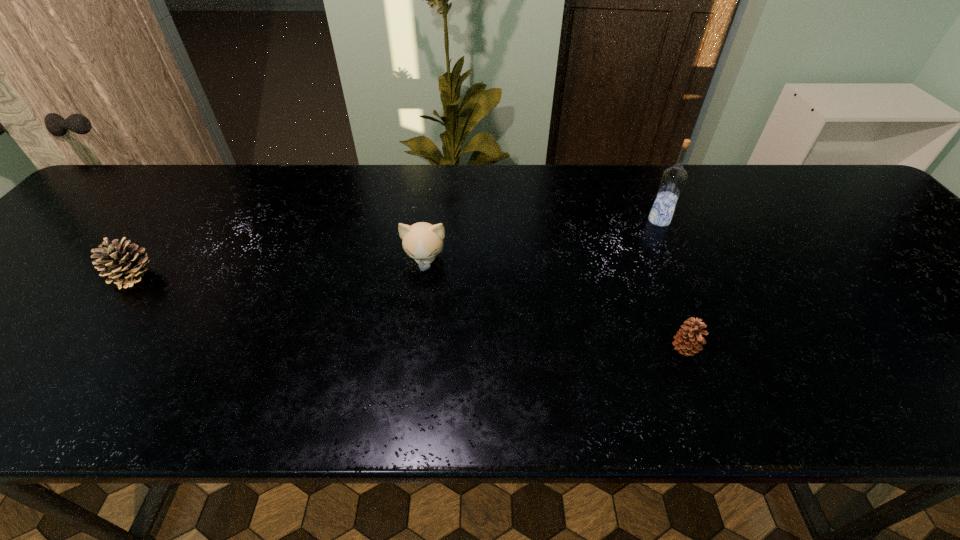
You are a GUI agent. You are given a task and a screenshot of the screen. Output one action in this format:
    pyautogui.click(x=<x>, y=<y>)
    Task: Click on the unoccupied area between the farthest object and the second object from right to left
    
    Given the screenshot: What is the action you would take?
    672,285

Where is `vacant region between the leftmost object and the right pinecone`? vacant region between the leftmost object and the right pinecone is located at coordinates (410, 313).

You are a GUI agent. You are given a task and a screenshot of the screen. Output one action in this format:
    pyautogui.click(x=<x>, y=<y>)
    Task: Click on the vacant point located between the rightmost object and the shorter pinecone
    
    Given the screenshot: What is the action you would take?
    pyautogui.click(x=672, y=285)

This screenshot has height=540, width=960. In order to click on vacant space that's between the taller pinecone and the nearest object in this screenshot , I will do (x=410, y=313).

Locate an element on the screen. vacant area that lies between the farthest object and the farther pinecone is located at coordinates (396, 248).

The image size is (960, 540). I want to click on free area in between the farthest object and the farther pinecone, so click(396, 248).

Identify which object is the third closest to the third object from left to right. Please provide its 2D coordinates. Your answer should be formatted as a tuple, i.e. [(x, y)], where the tuple contains the x and y coordinates of a point satisfying the conditions above.

[(125, 264)]

Where is `the closest object to the farther pinecone`? the closest object to the farther pinecone is located at coordinates (422, 241).

The height and width of the screenshot is (540, 960). Identify the location of free space in the image that satisfies the following two spatial constraints: 1. on the back side of the farthest object; 2. on the left side of the farther pinecone. (176, 220).

Image resolution: width=960 pixels, height=540 pixels. I want to click on free point that satisfies the following two spatial constraints: 1. on the face of the kitten; 2. on the left side of the shortest object, so click(x=414, y=349).